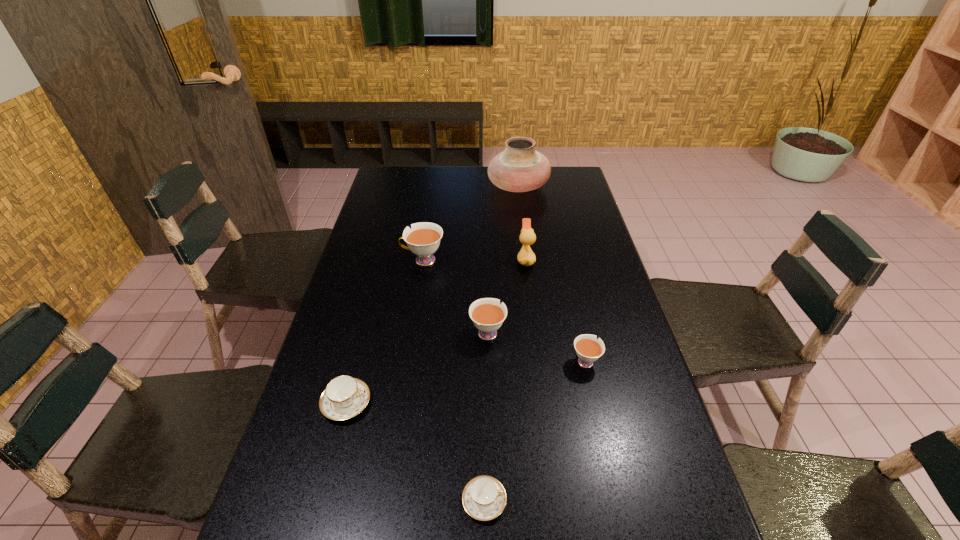
Where is `teacup that is at the right edge`? The image size is (960, 540). teacup that is at the right edge is located at coordinates (588, 348).

Find the location of a particular element. The height and width of the screenshot is (540, 960). object present at the far right corner is located at coordinates (520, 168).

At what (x,y) coordinates should I click in order to perform the action: click on vacant space at the far edge of the desktop. Please return your answer as a coordinate pair (x, y). Looking at the image, I should click on (473, 176).

Find the location of a particular element. The image size is (960, 540). free space at the left edge of the desktop is located at coordinates (360, 232).

This screenshot has width=960, height=540. In the image, there is a desktop. Identify the location of vacant space at the right edge. (607, 376).

Identify the location of free space at the far left corner of the desktop. (394, 192).

The width and height of the screenshot is (960, 540). In order to click on vacant area that lies between the farthest object and the smallest white teacup in this screenshot , I will do `click(552, 274)`.

Locate an element on the screen. vacant area that lies between the duck and the smaller blue teacup is located at coordinates [505, 380].

Locate an element on the screen. Image resolution: width=960 pixels, height=540 pixels. vacant point located between the rightmost white teacup and the tan duck is located at coordinates (556, 310).

Locate an element on the screen. The width and height of the screenshot is (960, 540). free space between the farther blue teacup and the second tallest teacup is located at coordinates (417, 367).